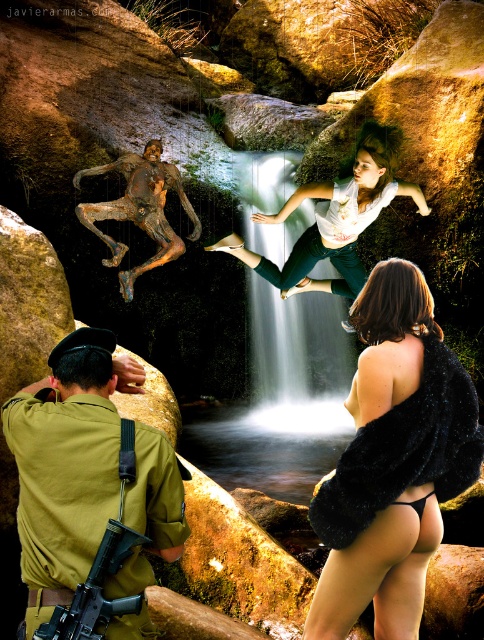
Does black fur coat at lower right have a smaller size compared to white matte shirt at upper center?

Yes.

Which is behind, point (335, 532) or point (344, 179)?

Positioned behind is point (344, 179).

Is point (330, 620) behind point (283, 298)?

No, (330, 620) is in front of (283, 298).

The width and height of the screenshot is (484, 640). Find the location of `black fur coat at lower right`. black fur coat at lower right is located at coordinates (393, 460).

Is black fur coat at lower right to the left of bronze sculpture at center from the viewer's perspective?

Incorrect, black fur coat at lower right is not on the left side of bronze sculpture at center.

Can you confirm if black fur coat at lower right is thinner than bronze sculpture at center?

Correct, black fur coat at lower right's width is less than bronze sculpture at center's.

Does point (422, 410) come in front of point (176, 177)?

Yes, point (422, 410) is closer to viewer.

Find the location of a particular element. This screenshot has height=640, width=484. black fur coat at lower right is located at coordinates (393, 460).

Can you confirm if white matte shirt at upper center is thinner than matte black rifle at lower left?

In fact, white matte shirt at upper center might be wider than matte black rifle at lower left.

Does white matte shirt at upper center have a larger size compared to matte black rifle at lower left?

Yes, white matte shirt at upper center is bigger than matte black rifle at lower left.

Between point (404, 182) and point (103, 550), which one is positioned in front?

Point (103, 550) is in front.

The height and width of the screenshot is (640, 484). What are the coordinates of `white matte shirt at upper center` in the screenshot? It's located at (335, 218).